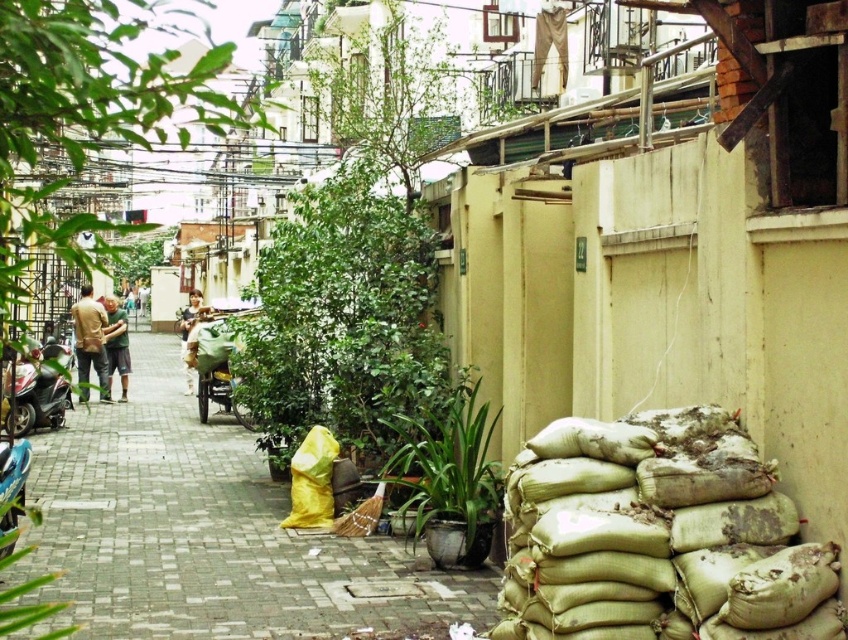
Is shiny metallic scooter at left closer to the viewer compared to brown leather jacket at center?

Yes, it is in front of brown leather jacket at center.

Does shiny metallic scooter at left have a lesser width compared to brown leather jacket at center?

Yes, shiny metallic scooter at left is thinner than brown leather jacket at center.

The height and width of the screenshot is (640, 848). I want to click on shiny metallic scooter at left, so click(x=38, y=388).

Is gray concrete pavement at center above green matte shirt at center?

Incorrect, gray concrete pavement at center is not positioned above green matte shirt at center.

Who is higher up, gray concrete pavement at center or green matte shirt at center?

Positioned higher is green matte shirt at center.

Is point (467, 593) in front of point (120, 376)?

That is True.

Where is `gray concrete pavement at center`? The height and width of the screenshot is (640, 848). gray concrete pavement at center is located at coordinates (208, 532).

Is brown leather jacket at center above green matte shirt at center?

No.

Who is positioned more to the right, brown leather jacket at center or green matte shirt at center?

Positioned to the right is brown leather jacket at center.

Image resolution: width=848 pixels, height=640 pixels. What do you see at coordinates (91, 342) in the screenshot?
I see `brown leather jacket at center` at bounding box center [91, 342].

Find the location of a particular element. brown leather jacket at center is located at coordinates (91, 342).